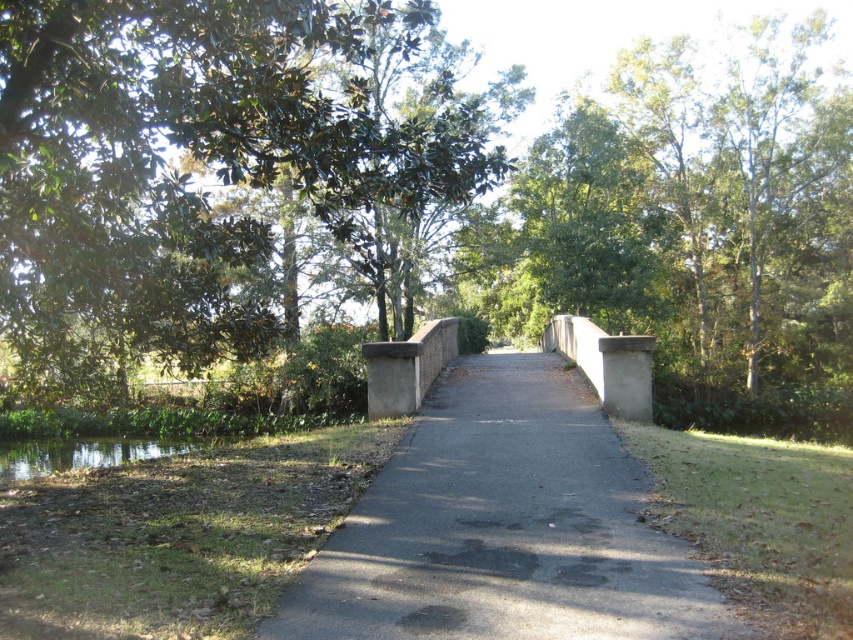
This screenshot has width=853, height=640. I want to click on green leafy tree at upper left, so click(x=192, y=170).

Which is behind, point (129, 337) or point (24, 476)?

The point (24, 476) is behind.

Image resolution: width=853 pixels, height=640 pixels. In order to click on green leafy tree at upper left in this screenshot , I will do `click(192, 170)`.

What do you see at coordinates (503, 525) in the screenshot? I see `gray asphalt pavement at center` at bounding box center [503, 525].

This screenshot has height=640, width=853. In order to click on gray asphalt pavement at center in this screenshot , I will do `click(503, 525)`.

Does point (383, 625) lie behind point (9, 440)?

No.

Where is `gray asphalt pavement at center`? The width and height of the screenshot is (853, 640). gray asphalt pavement at center is located at coordinates (503, 525).

Does point (277, 77) lie in front of point (496, 376)?

Yes.

Describe the element at coordinates (192, 170) in the screenshot. The image size is (853, 640). I see `green leafy tree at upper left` at that location.

Is point (293, 102) farther from camera compared to point (595, 582)?

Yes, it is behind point (595, 582).

The height and width of the screenshot is (640, 853). In order to click on green leafy tree at upper left in this screenshot , I will do `click(192, 170)`.